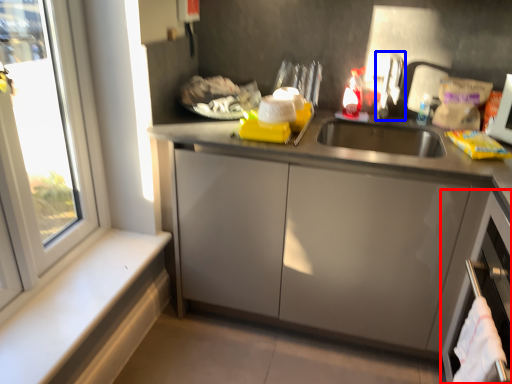
Question: Which object appears closest to the camera in this image, dish washer (highlighted by a red box) or faucet (highlighted by a blue box)?

Choices:
 (A) dish washer
 (B) faucet

Answer: (A)